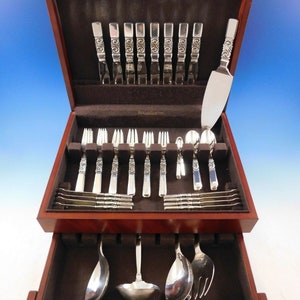
Find the location of a particular element. The image size is (300, 300). knives is located at coordinates (101, 50), (116, 57), (126, 56), (140, 58), (153, 62), (163, 67), (176, 72), (188, 72).